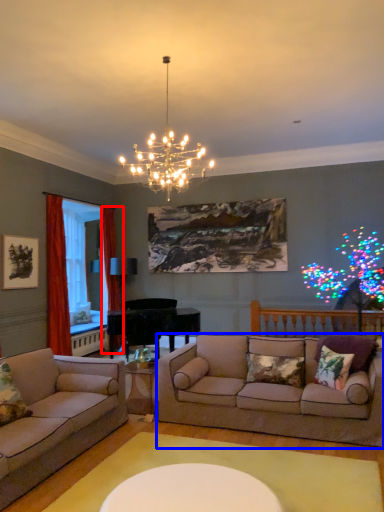
Question: Which of the following is the closest to the observer, curtain (highlighted by a red box) or studio couch (highlighted by a blue box)?

Choices:
 (A) curtain
 (B) studio couch

Answer: (B)